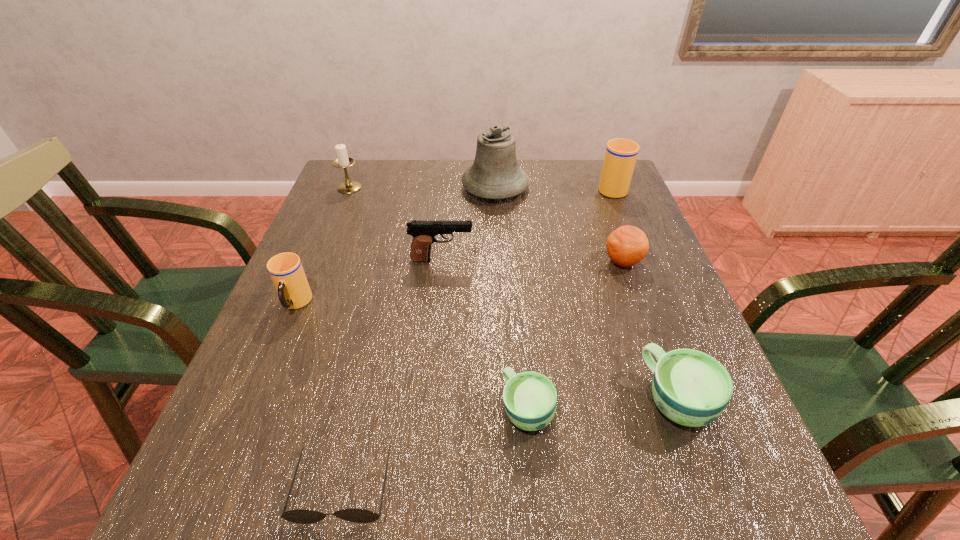
This screenshot has width=960, height=540. Find the location of `the smaller blue cup`. the smaller blue cup is located at coordinates pyautogui.click(x=530, y=398).

Image resolution: width=960 pixels, height=540 pixels. I want to click on the second cup from left to right, so point(530,398).

Identify the location of black sunglasses. The height and width of the screenshot is (540, 960). (299, 516).

Locate an element on the screen. This screenshot has width=960, height=540. sunglasses is located at coordinates (299, 516).

Image resolution: width=960 pixels, height=540 pixels. In order to click on free space located 0.060m on the right of the bell in this screenshot , I will do `click(549, 187)`.

The image size is (960, 540). Identify the location of vacant area situated on the side of the farthest cup with the handle. (600, 159).

Locate an element on the screen. This screenshot has height=540, width=960. vacant region located 0.050m on the side of the farthest cup with the handle is located at coordinates (604, 168).

This screenshot has width=960, height=540. I want to click on vacant space located on the right of the white candle holder, so click(464, 187).

At what (x,y) coordinates should I click in order to perform the action: click on free space located 0.140m at the barrel of the black pistol. Please return your answer as a coordinate pair (x, y). Image resolution: width=960 pixels, height=540 pixels. Looking at the image, I should click on (531, 260).

The height and width of the screenshot is (540, 960). I want to click on free location located 0.070m on the side of the second farthest cup with the handle, so click(x=277, y=347).